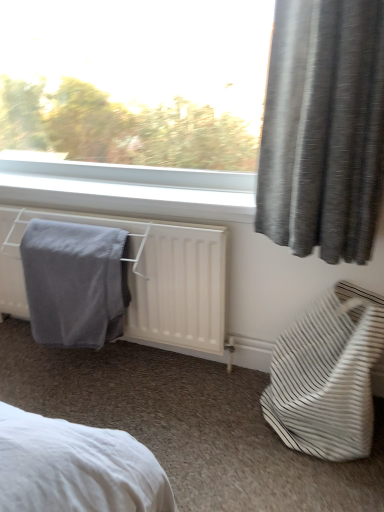
This screenshot has height=512, width=384. Identify the location of vacant space underneath gray soft towel at lower left (from a real-world perspective). (78, 360).